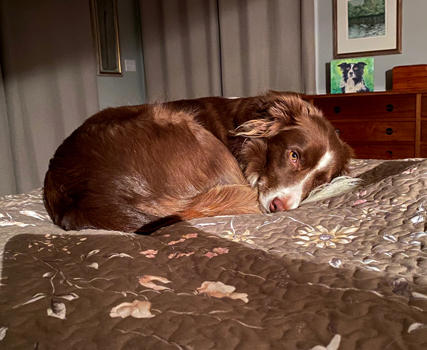
I want to click on curtains, so click(61, 105), click(184, 68).